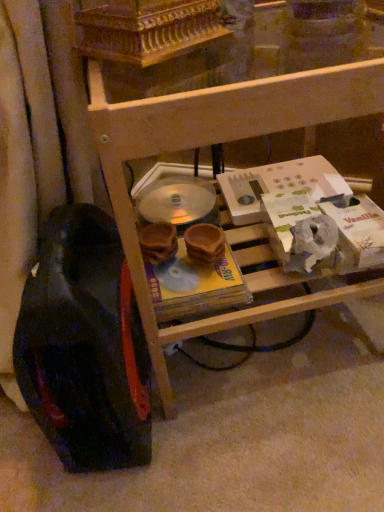
Question: In terms of size, does black rubber wheel at lower left appear bigger or smaller than wooden shelf at center?

Choices:
 (A) big
 (B) small

Answer: (B)

Question: Would you say black rubber wheel at lower left is inside or outside wooden shelf at center?

Choices:
 (A) inside
 (B) outside

Answer: (B)

Question: Is point (62, 448) positioned closer to the camera than point (355, 287)?

Choices:
 (A) farther
 (B) closer

Answer: (B)

Question: Considering their positions, is wooden shelf at center located in front of or behind black rubber wheel at lower left?

Choices:
 (A) behind
 (B) front

Answer: (B)

Question: Is wooden shelf at center inside the boundaries of black rubber wheel at lower left, or outside?

Choices:
 (A) outside
 (B) inside

Answer: (A)

Question: In terms of height, does wooden shelf at center look taller or shorter compared to black rubber wheel at lower left?

Choices:
 (A) tall
 (B) short

Answer: (A)

Question: Considering the positions of point (307, 108) and point (46, 271), is point (307, 108) closer or farther from the camera than point (46, 271)?

Choices:
 (A) farther
 (B) closer

Answer: (B)